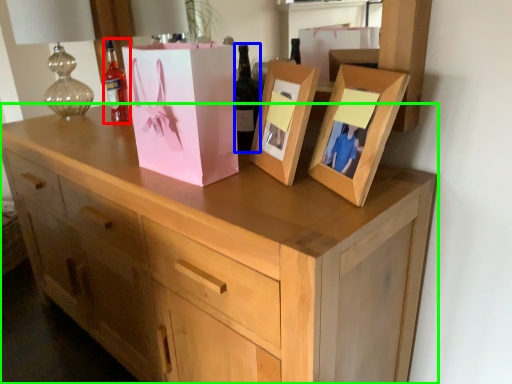
Question: Based on their relative distances, which object is farther from bottle (highlighted by a red box)? Choose from bottle (highlighted by a blue box) and chest of drawers (highlighted by a green box).

Choices:
 (A) bottle
 (B) chest of drawers

Answer: (B)